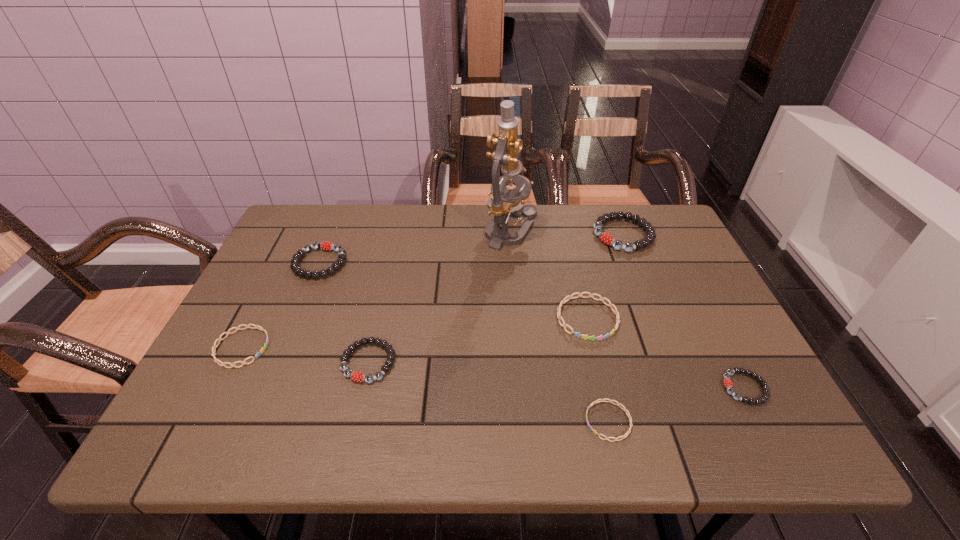
Locate an element on the screen. The width and height of the screenshot is (960, 540). object that is the second closest to the leftmost blue bracelet is located at coordinates [356, 376].

Locate which bracelet is the second closest to the tallest bracelet. Please provide its 2D coordinates. Your answer should be formatted as a tuple, i.e. [(x, y)], where the tuple contains the x and y coordinates of a point satisfying the conditions above.

[(727, 382)]

Identify which bracelet is the third closest to the smallest blue bracelet. Please provide its 2D coordinates. Your answer should be formatted as a tuple, i.e. [(x, y)], where the tuple contains the x and y coordinates of a point satisfying the conditions above.

[(356, 376)]

This screenshot has width=960, height=540. In order to click on black bracelet identified as the fourth closest to the second smallest blue bracelet in this screenshot , I will do `click(727, 382)`.

Identify the location of black bracelet that is the closest to the leftmost black bracelet. The image size is (960, 540). (356, 376).

Select which blue bracelet appears as the closest to the smallest blue bracelet. Please provide its 2D coordinates. Your answer should be formatted as a tuple, i.e. [(x, y)], where the tuple contains the x and y coordinates of a point satisfying the conditions above.

[(569, 297)]

Identify which blue bracelet is the nearest to the seventh shortest object. Please provide its 2D coordinates. Your answer should be formatted as a tuple, i.e. [(x, y)], where the tuple contains the x and y coordinates of a point satisfying the conditions above.

[(569, 297)]

The height and width of the screenshot is (540, 960). What are the coordinates of `free space that satisfies the following two spatial constraints: 1. on the surface of the third biggest black bracelet showing star-shaped elements; 2. on the left side of the second smallest blue bracelet` in the screenshot? It's located at (234, 362).

You are a GUI agent. You are given a task and a screenshot of the screen. Output one action in this format:
    pyautogui.click(x=<x>, y=<y>)
    Task: Click on the free space that satisfies the following two spatial constraints: 1. on the front side of the sixth object from right to left; 2. on the left side of the smallest black bracelet
    
    Given the screenshot: What is the action you would take?
    click(363, 388)

Locate an element on the screen. vacant space that satisfies the following two spatial constraints: 1. on the front side of the smallest black bracelet; 2. on the left side of the fifth object from right to left is located at coordinates 523,388.